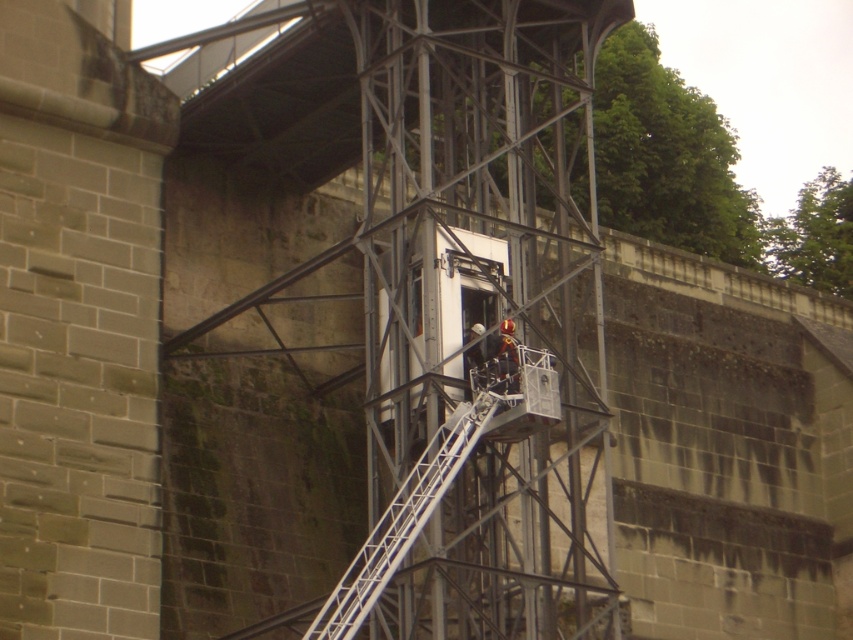
Which is behind, point (444, 426) or point (508, 321)?

The point (508, 321) is more distant.

Does point (329, 595) lie in front of point (508, 372)?

Yes, it is.

At what (x,y) coordinates should I click in order to perform the action: click on metallic silver ladder at center. Please return your answer as a coordinate pair (x, y). Looking at the image, I should click on (404, 518).